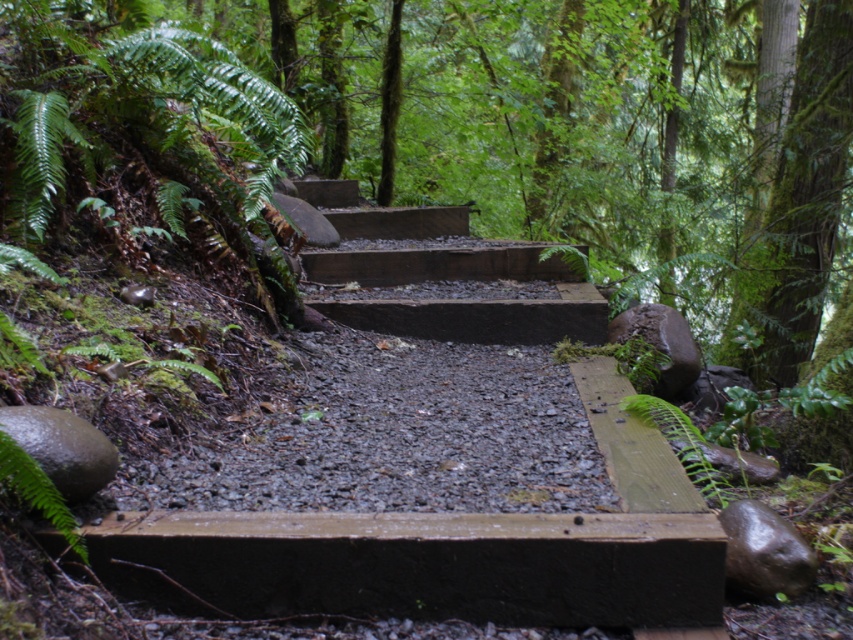
You are standing at the bottom of the brown wooden stairs at center in a forest. You want to take a photo of the stairs from a distance so that they appear small in the frame. If you walk 5 meters away from the stairs, will they look smaller than if you were standing at the bottom?

Yes, because the brown wooden stairs at center are currently 4.25 meters away from the camera. Walking an additional 5 meters away would increase the distance to 9.25 meters, making them appear smaller in the photo.

You are standing at the point with coordinates (442,275) in the forest. What object is located exactly at your current position?

The brown wooden stairs at center are located exactly at the point with coordinates (442,275).